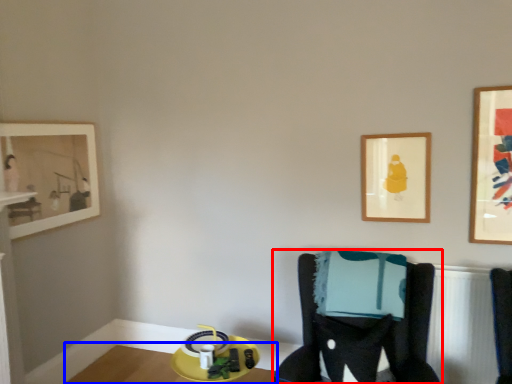
Question: Among these objects, which one is farthest to the camera, furniture (highlighted by a red box) or table (highlighted by a blue box)?

Choices:
 (A) furniture
 (B) table

Answer: (B)